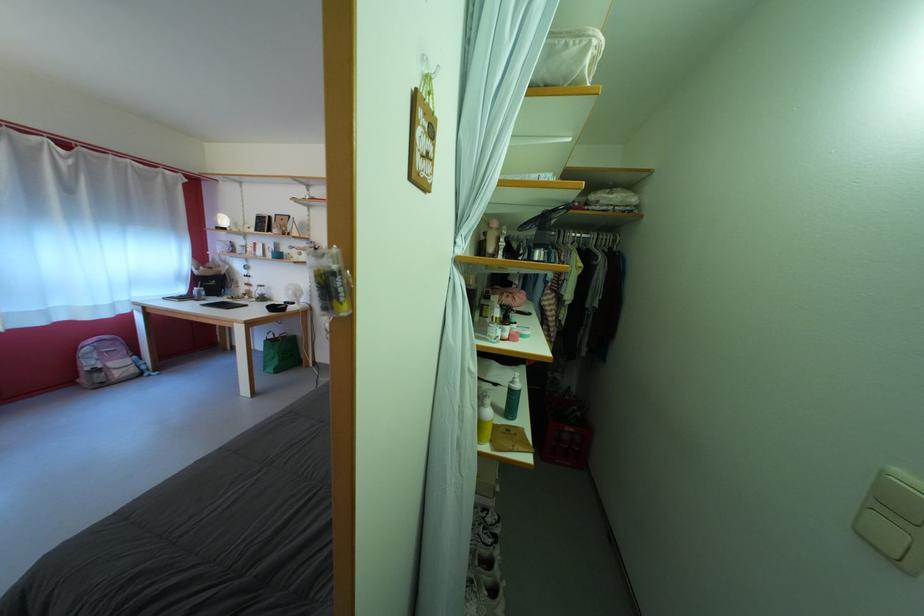
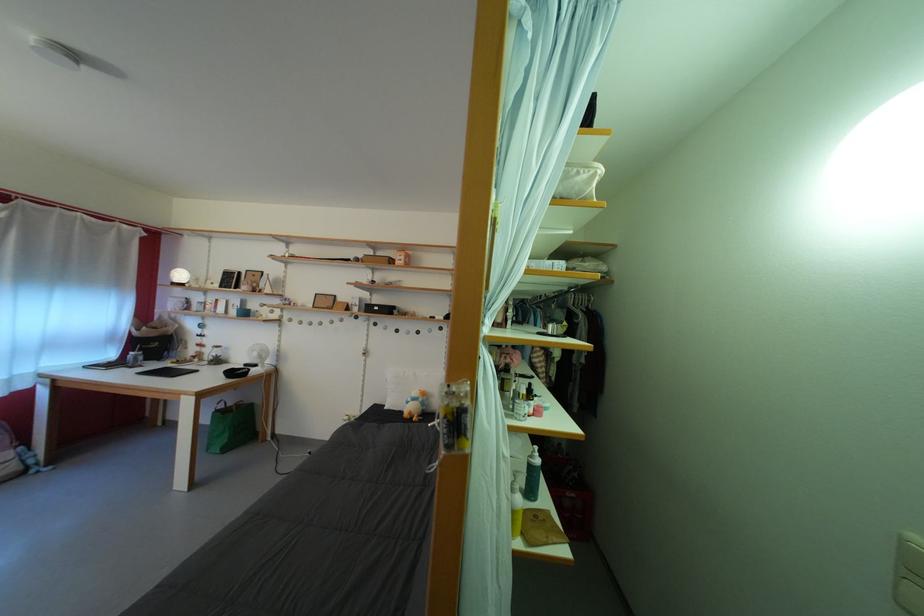
Where in the second image is the point corresponding to point 575,52 from the first image?

(587, 179)